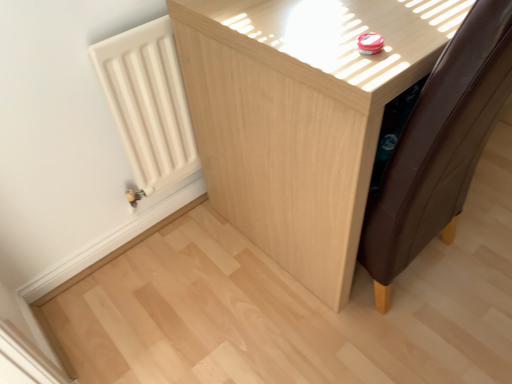
This screenshot has height=384, width=512. Describe the element at coordinates (298, 122) in the screenshot. I see `light wood cabinet at center` at that location.

Measure the distance between point (366, 121) and camera.

29.76 inches.

Identify the location of light wood cabinet at center. The height and width of the screenshot is (384, 512). (298, 122).

Based on the photo, measure the distance between point (176,161) and camera.

Point (176,161) is 4.52 feet from camera.

Where is `white matte radiator at left`? white matte radiator at left is located at coordinates click(148, 104).

What do you see at coordinates (148, 104) in the screenshot? I see `white matte radiator at left` at bounding box center [148, 104].

In order to click on light wood cabinet at center in this screenshot , I will do `click(298, 122)`.

Is light wood cabinet at center to the right of white matte radiator at left from the viewer's perspective?

Indeed, light wood cabinet at center is positioned on the right side of white matte radiator at left.

Is light wood cabinet at center positioned in front of white matte radiator at left?

Yes, the depth of light wood cabinet at center is less than that of white matte radiator at left.

Considering the positions of point (248, 225) and point (164, 88), is point (248, 225) closer or farther from the camera than point (164, 88)?

Point (248, 225) is farther from the camera than point (164, 88).

From the image's perspective, relative to white matte radiator at left, is light wood cabinet at center above or below?

Based on their image positions, light wood cabinet at center is located above white matte radiator at left.

From a real-world perspective, is light wood cabinet at center on white matte radiator at left?

Incorrect, from a real-world perspective, light wood cabinet at center is lower than white matte radiator at left.

In terms of width, does light wood cabinet at center look wider or thinner when compared to white matte radiator at left?

Considering their sizes, light wood cabinet at center looks broader than white matte radiator at left.

Does light wood cabinet at center have a lesser height compared to white matte radiator at left?

In fact, light wood cabinet at center may be taller than white matte radiator at left.

Considering the sizes of objects light wood cabinet at center and white matte radiator at left in the image provided, who is bigger, light wood cabinet at center or white matte radiator at left?

light wood cabinet at center.

Could white matte radiator at left be considered to be inside light wood cabinet at center?

That's incorrect, white matte radiator at left is not inside light wood cabinet at center.

Is light wood cabinet at center not near white matte radiator at left?

No, light wood cabinet at center is not far away from white matte radiator at left.

Is light wood cabinet at center facing away from white matte radiator at left?

No.

Where is `radiator behind the light wood cabinet at center`? This screenshot has width=512, height=384. radiator behind the light wood cabinet at center is located at coordinates [148, 104].

Which object is positioned more to the right, white matte radiator at left or light wood cabinet at center?

From the viewer's perspective, light wood cabinet at center appears more on the right side.

Does white matte radiator at left lie in front of light wood cabinet at center?

No.

Does point (154, 112) lie behind point (186, 42)?

Yes, point (154, 112) is farther from viewer.

From the image's perspective, is white matte radiator at left below light wood cabinet at center?

Correct, white matte radiator at left appears lower than light wood cabinet at center in the image.

From a real-world perspective, is white matte radiator at left below light wood cabinet at center?

No, from a real-world perspective, white matte radiator at left is not under light wood cabinet at center.

Can you confirm if white matte radiator at left is wider than light wood cabinet at center?

No, white matte radiator at left is not wider than light wood cabinet at center.

Considering the sizes of white matte radiator at left and light wood cabinet at center in the image, is white matte radiator at left taller or shorter than light wood cabinet at center?

Considering their sizes, white matte radiator at left has less height than light wood cabinet at center.

Does white matte radiator at left have a smaller size compared to light wood cabinet at center?

Correct, white matte radiator at left occupies less space than light wood cabinet at center.

Is light wood cabinet at center surrounded by white matte radiator at left?

No, light wood cabinet at center is not a part of white matte radiator at left.

Is white matte radiator at left far away from light wood cabinet at center?

No.

Looking at this image, is white matte radiator at left oriented away from light wood cabinet at center?

No, white matte radiator at left is not facing the opposite direction of light wood cabinet at center.

What's the angular difference between white matte radiator at left and light wood cabinet at center's facing directions?

The angular difference between white matte radiator at left and light wood cabinet at center is 0.843 degrees.

How far apart are white matte radiator at left and light wood cabinet at center?

white matte radiator at left and light wood cabinet at center are 11.58 inches apart.

Where is `furniture below the white matte radiator at left (from a real-world perspective)`? furniture below the white matte radiator at left (from a real-world perspective) is located at coordinates (298, 122).

Identify the location of radiator located behind the light wood cabinet at center. The width and height of the screenshot is (512, 384). (148, 104).

Locate an element on the screen. The image size is (512, 384). furniture on the right of white matte radiator at left is located at coordinates (298, 122).